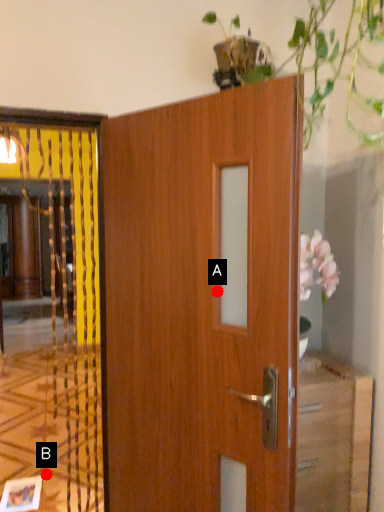
Question: Two points are circled on the image, labeled by A and B beside each circle. Which point is farther to the camera?

Choices:
 (A) A is further
 (B) B is further

Answer: (B)